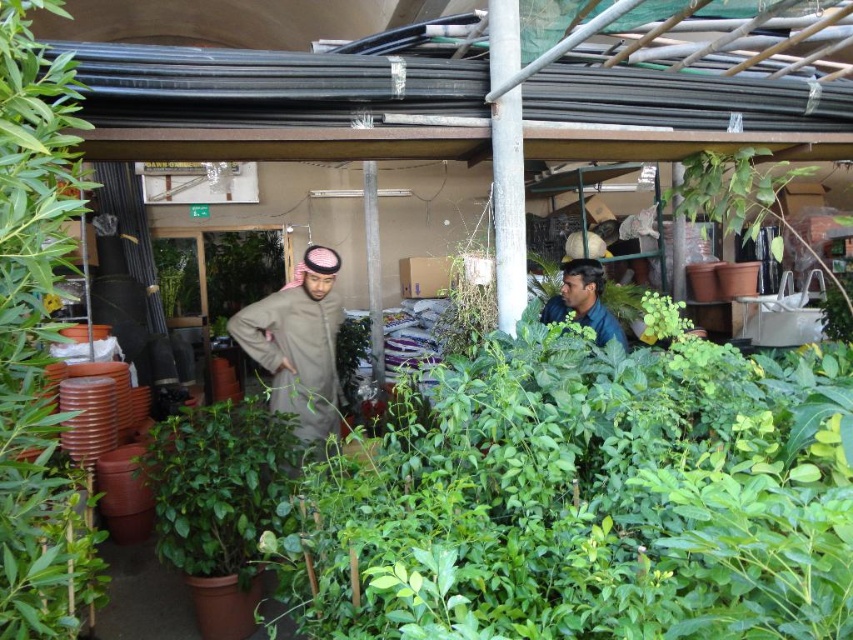
You are a customer at the nursery and want to buy a plant that can fit through a narrow doorway. You see the light brown fabric trench coat at center and the dark blue shirt at center. Which item is smaller and more likely to fit through the doorway?

The dark blue shirt at center is smaller than the light brown fabric trench coat at center, so it is more likely to fit through the narrow doorway.

You are standing at the entrance of the nursery and see the light brown fabric trench coat at center. If you walk straight ahead, will you pass directly in front of the trench coat?

The light brown fabric trench coat at center is located at point (296, 349). Since you are starting at the entrance and walking straight ahead, your path would pass directly in front of the trench coat at center.